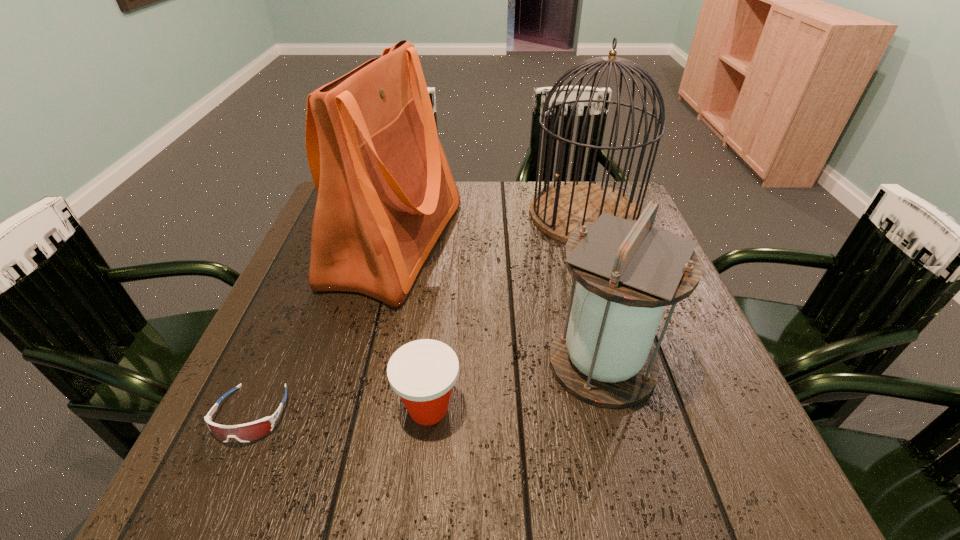
Locate an element on the screen. Image resolution: width=960 pixels, height=540 pixels. birdcage is located at coordinates (559, 210).

You are a GUI agent. You are given a task and a screenshot of the screen. Output one action in this format:
    pyautogui.click(x=<x>, y=<y>)
    Task: Click on the shopping bag
    
    Given the screenshot: What is the action you would take?
    pyautogui.click(x=385, y=190)

Locate an element on the screen. The height and width of the screenshot is (540, 960). lantern is located at coordinates (627, 271).

Find the location of a particular element. Image resolution: width=960 pixels, height=540 pixels. the fourth tallest object is located at coordinates (423, 372).

The width and height of the screenshot is (960, 540). What are the coordinates of `goggles` in the screenshot? It's located at (247, 432).

Locate an element on the screen. This screenshot has width=960, height=540. blank area located at the door of the birdcage is located at coordinates (600, 262).

The width and height of the screenshot is (960, 540). Find the location of `vacant space located on the front of the shopping bag`. vacant space located on the front of the shopping bag is located at coordinates (372, 337).

Identify the location of free space located 0.310m on the back of the third tallest object. Image resolution: width=960 pixels, height=540 pixels. (569, 235).

Image resolution: width=960 pixels, height=540 pixels. Identify the location of vacant region located 0.250m on the right of the fourth tallest object. (604, 408).

Identify the location of free space located on the front-facing side of the shortest object. (218, 491).